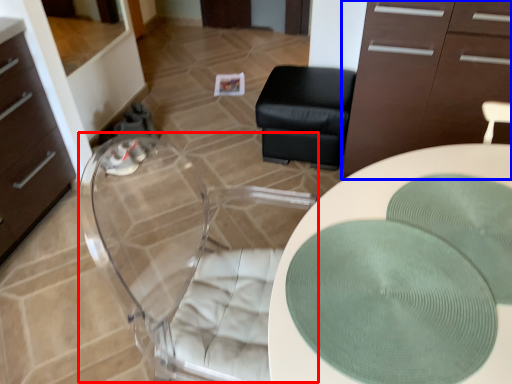
Question: Which point is closer to the camera, swivel chair (highlighted by a red box) or cabinetry (highlighted by a blue box)?

Choices:
 (A) swivel chair
 (B) cabinetry

Answer: (A)